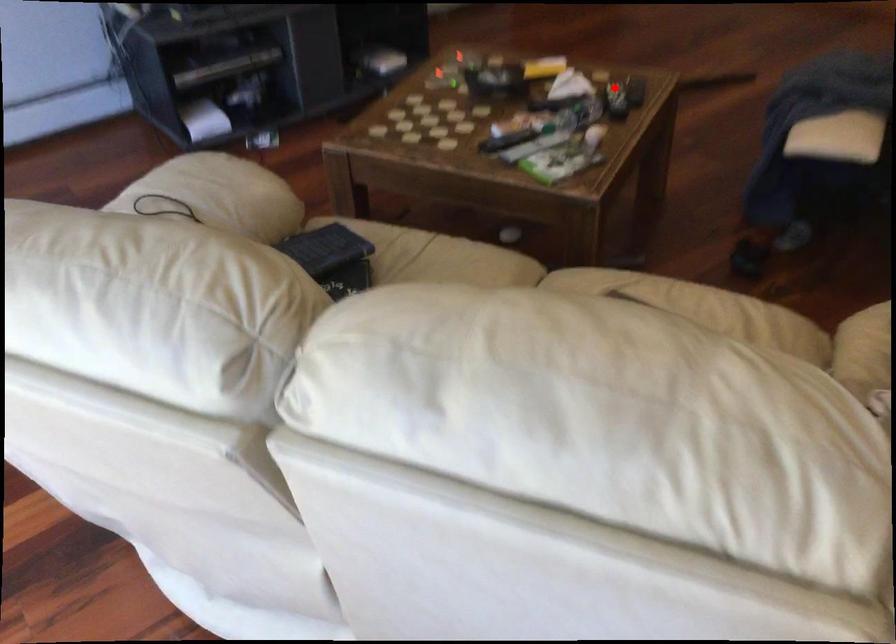
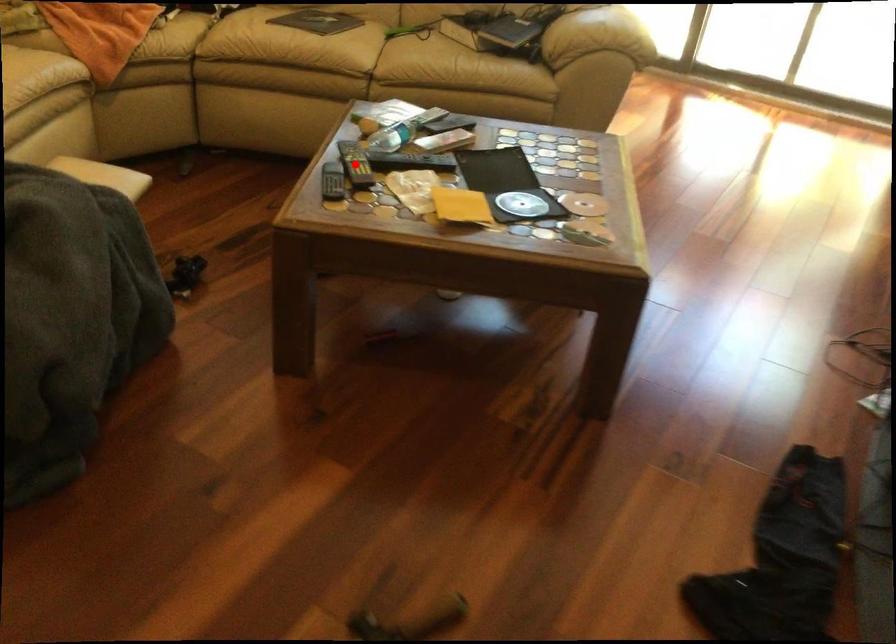
I am providing you with two images of the same scene from different viewpoints. A red point is marked on the first image and another point is marked on the second image. Are the points marked in image1 and image2 representing the same 3D position?

Yes